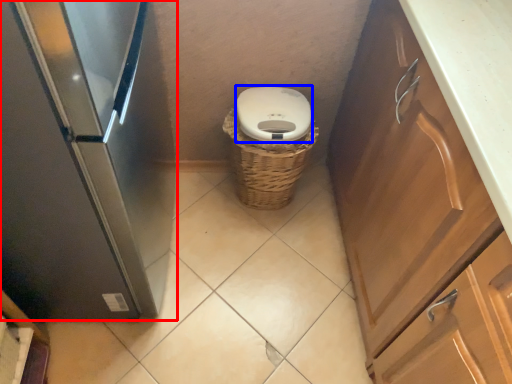
Question: Among these objects, which one is nearest to the camera, home appliance (highlighted by a red box) or toilet bowl (highlighted by a blue box)?

Choices:
 (A) home appliance
 (B) toilet bowl

Answer: (A)